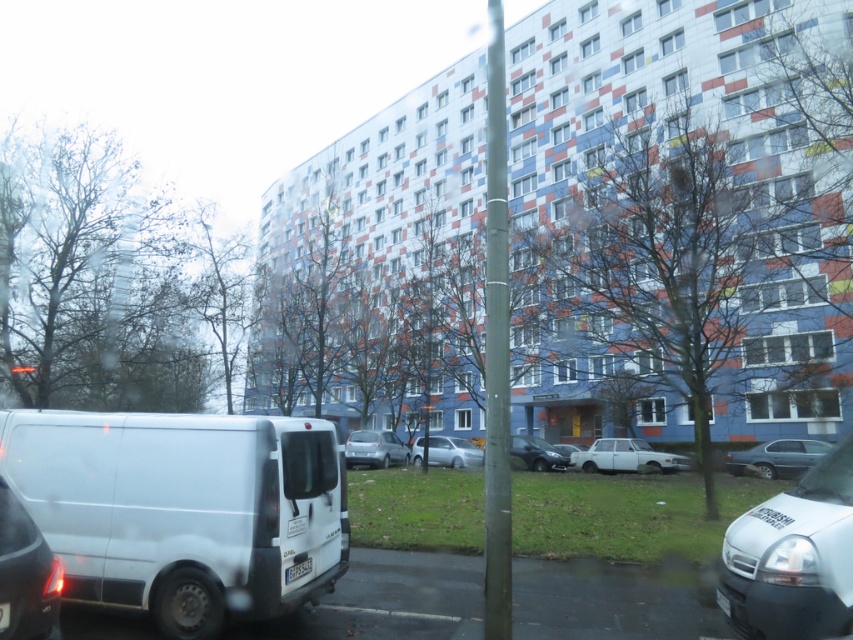
Question: Which object appears closest to the camera in this image?

Choices:
 (A) white matte van at lower right
 (B) matte white van at lower left
 (C) white plastic license plate at lower center

Answer: (B)

Question: Which point is closer to the camera?

Choices:
 (A) (457, 464)
 (B) (775, 467)

Answer: (B)

Question: Does metallic blue sedan at center-right lie behind white plastic license plate at lower center?

Choices:
 (A) no
 (B) yes

Answer: (B)

Question: Considering the relative positions of metallic blue sedan at center-right and shiny black sedan at center in the image provided, where is metallic blue sedan at center-right located with respect to shiny black sedan at center?

Choices:
 (A) left
 (B) right

Answer: (B)

Question: Which object appears closest to the camera in this image?

Choices:
 (A) white plastic license plate at lower center
 (B) white matte van at lower right
 (C) white matte sedan at center
 (D) silver metallic car at center

Answer: (B)

Question: Is matte white van at lower left closer to camera compared to metallic blue sedan at center-right?

Choices:
 (A) no
 (B) yes

Answer: (B)